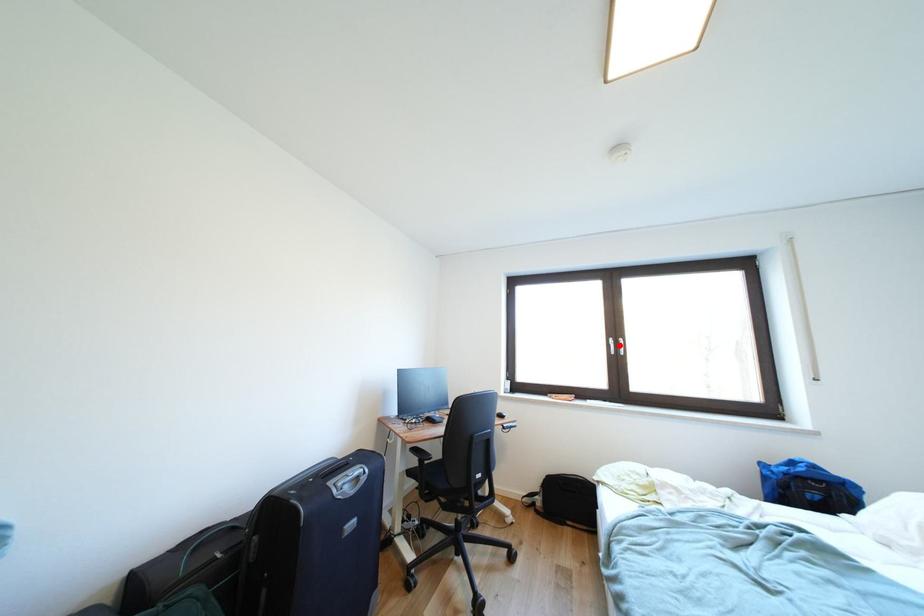
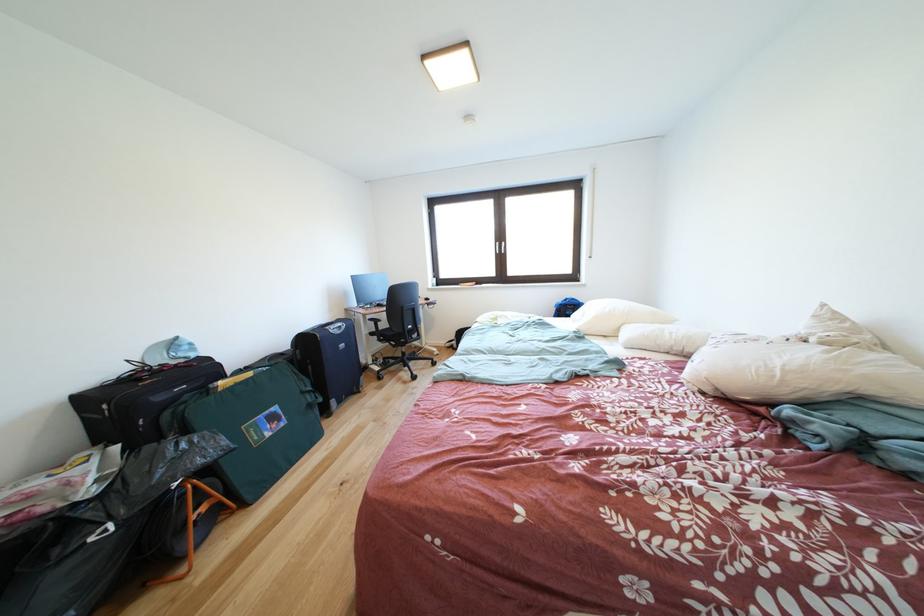
Question: A red point is marked in image1. In image2, is the corresponding 3D point closer to the camera or farther? Reply with the corresponding letter.

Choices:
 (A) The corresponding 3D point is closer.
 (B) The corresponding 3D point is farther.

Answer: (A)